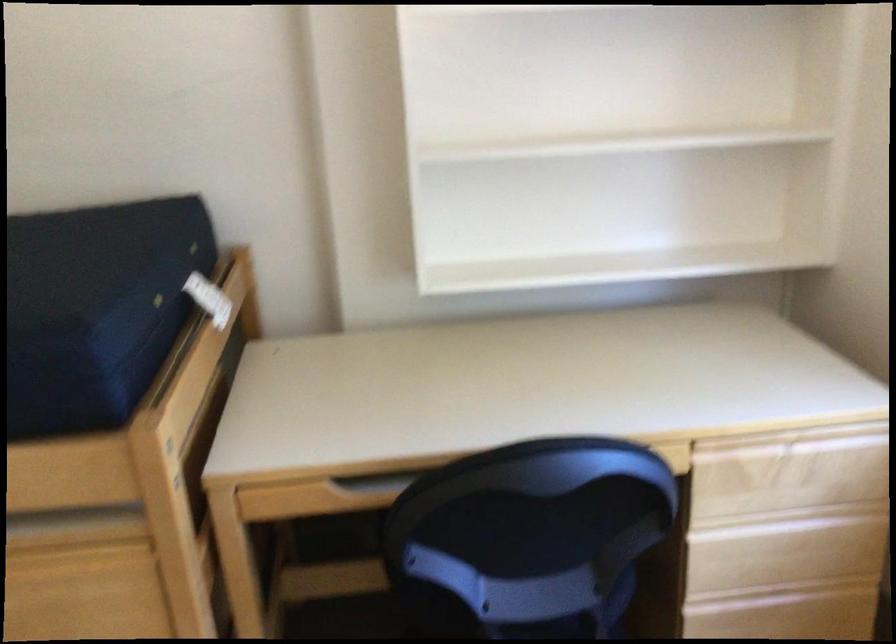
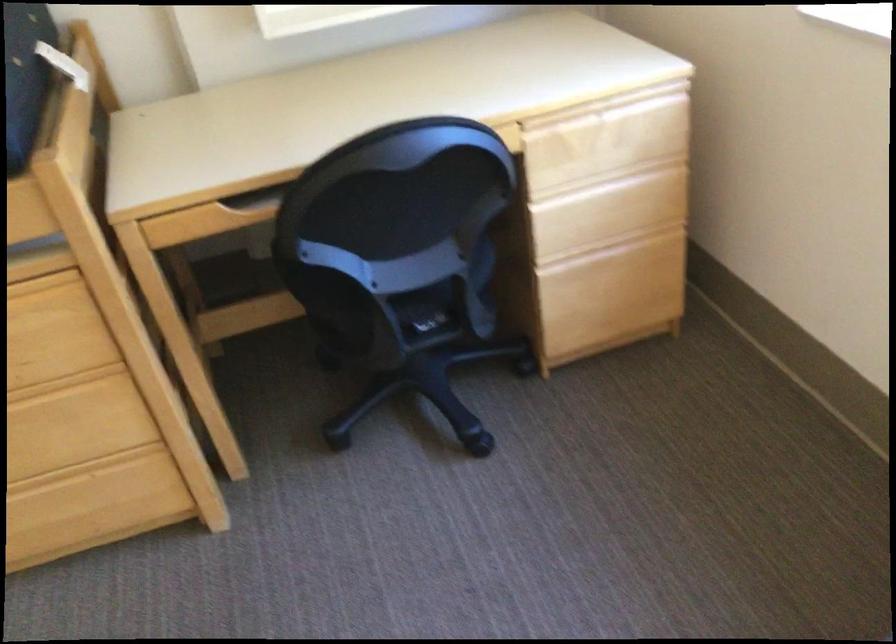
Locate, in the second image, the point that corresponds to pixel 789 516 in the first image.

(607, 180)